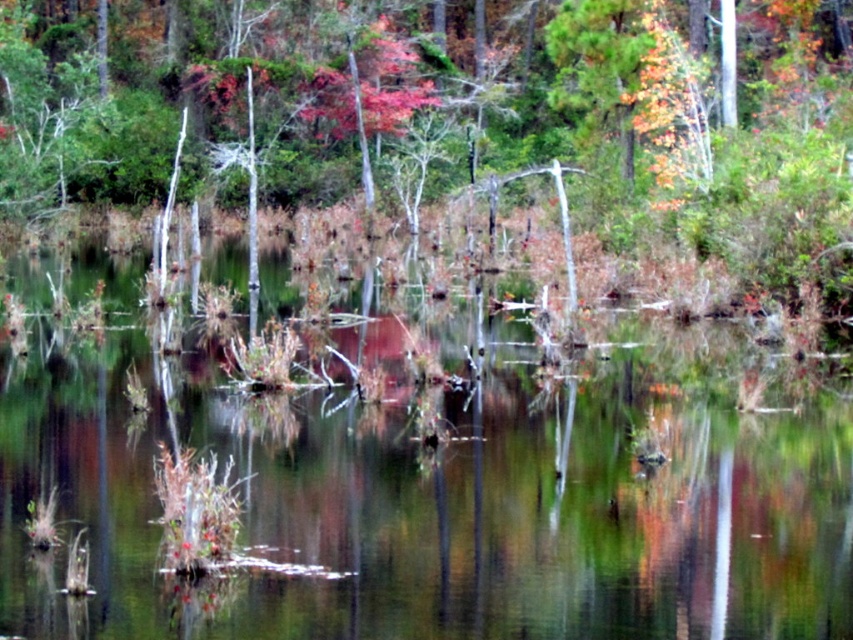
Can you confirm if green reflective water at center is positioned above smooth bark tree at center?

Incorrect, green reflective water at center is not positioned above smooth bark tree at center.

Describe the element at coordinates (434, 506) in the screenshot. This screenshot has height=640, width=853. I see `green reflective water at center` at that location.

Which is behind, point (210, 432) or point (781, 202)?

Positioned behind is point (781, 202).

At what (x,y) coordinates should I click in order to perform the action: click on green reflective water at center. Please return your answer as a coordinate pair (x, y). Looking at the image, I should click on pos(434,506).